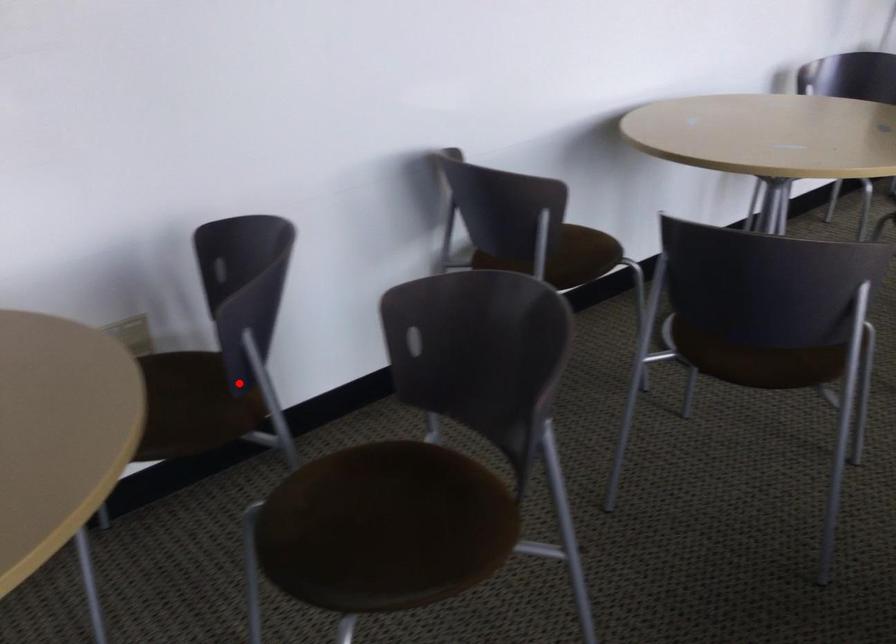
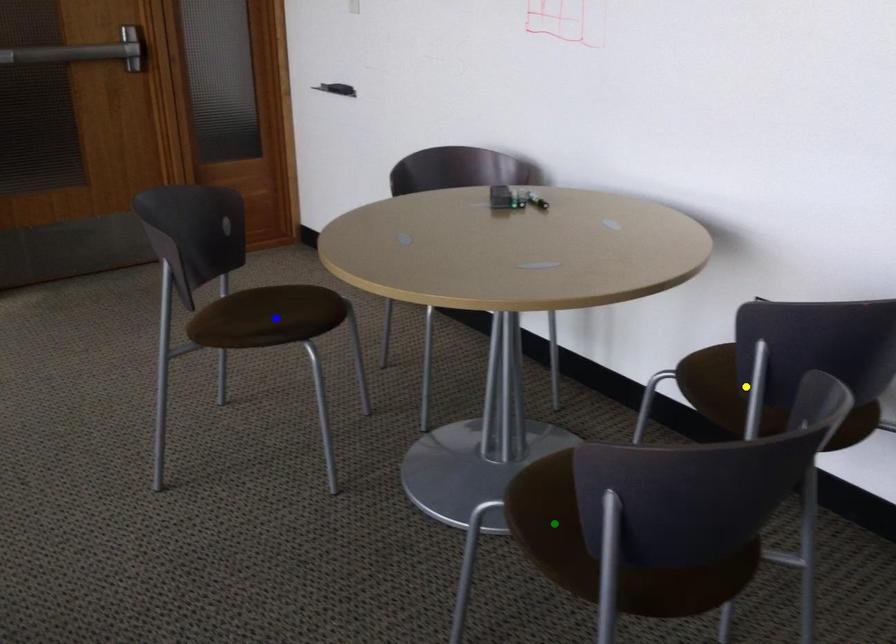
Question: I am providing you with two images of the same scene from different viewpoints. A red point is marked on the first image. You are given multiple points on the second image. Can you choose the point in image 2 that corresponds to the point in image 1?

Choices:
 (A) yellow point
 (B) blue point
 (C) green point

Answer: (A)